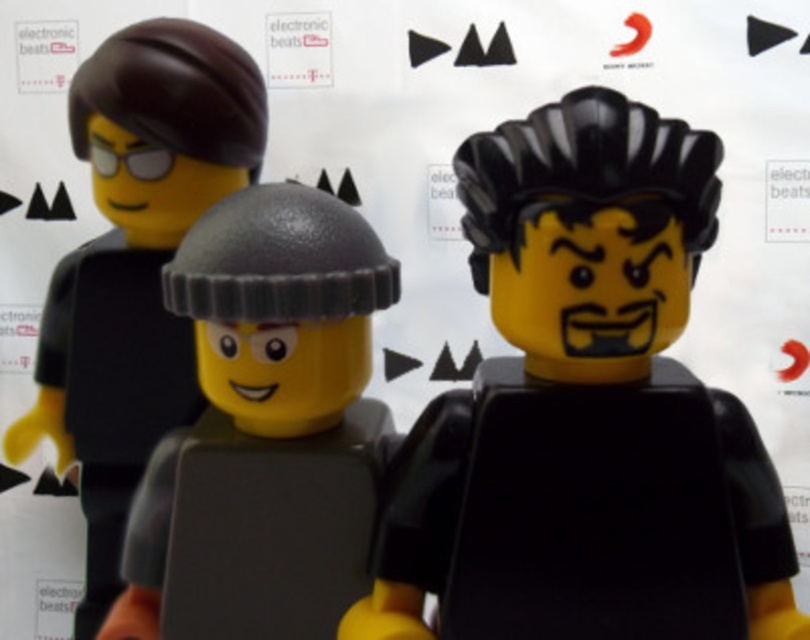
Question: Which of these objects is positioned closest to the matte black helmet at center?

Choices:
 (A) matte gray helmet at center
 (B) matte black helmet at left

Answer: (A)

Question: Which is nearer to the matte black helmet at left?

Choices:
 (A) matte gray helmet at center
 (B) matte black helmet at center

Answer: (A)

Question: Can you confirm if matte black helmet at center is wider than matte gray helmet at center?

Choices:
 (A) no
 (B) yes

Answer: (B)

Question: Is matte black helmet at center below matte black helmet at left?

Choices:
 (A) yes
 (B) no

Answer: (A)

Question: Where is matte black helmet at left located in relation to matte gray helmet at center in the image?

Choices:
 (A) above
 (B) below

Answer: (A)

Question: Among these points, which one is nearest to the camera?

Choices:
 (A) (96, 248)
 (B) (586, 152)
 (C) (267, 289)

Answer: (B)